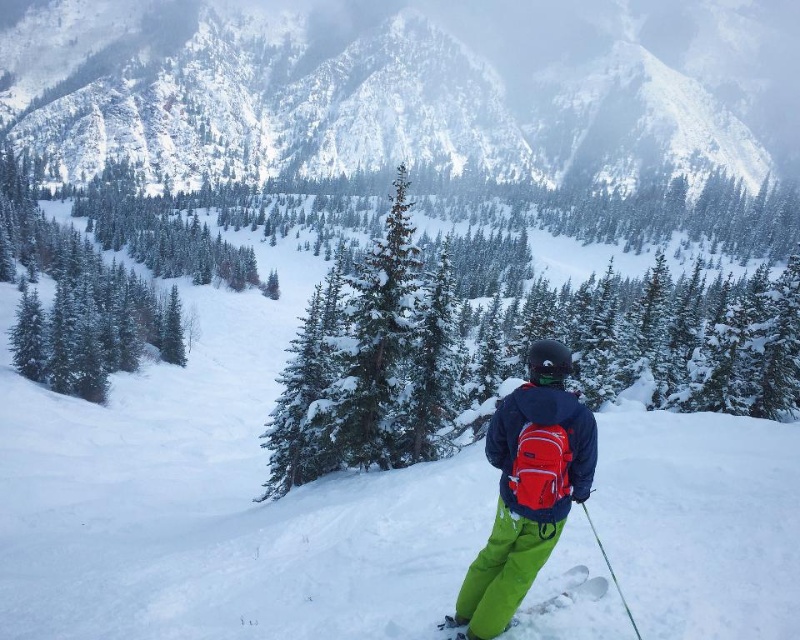
You are a photographer planning to capture the snowy forested mountain at upper center and the green matte ski pants at center in a single frame. Based on their positions, which object should you focus on first to ensure both are in focus?

The snowy forested mountain at upper center is above the green matte ski pants at center, so you should focus on the snowy forested mountain at upper center first to ensure both are in focus.

You are a drone operator tasked with capturing aerial footage of the snowy forested mountain at upper center and the green plastic ski pole at lower right. The drone has a maximum flight range of 300 meters. Can the drone safely capture footage of both objects without exceeding its range?

The distance between the snowy forested mountain at upper center and the green plastic ski pole at lower right is 314.64 meters, which exceeds the drone operator drone maximum flight range of 300 meters. Therefore, the drone cannot safely capture footage of both objects without exceeding its range.

You are a photographer standing at the base of the snowy forested mountain at upper center. You want to take a photo of the mountain using a camera that has a maximum focus range of 200 meters. Will the camera be able to focus on the mountain?

The snowy forested mountain at upper center and camera are 229.74 meters apart, which exceeds the camera maximum focus range of 200 meters. Therefore, the camera will not be able to focus on the mountain.